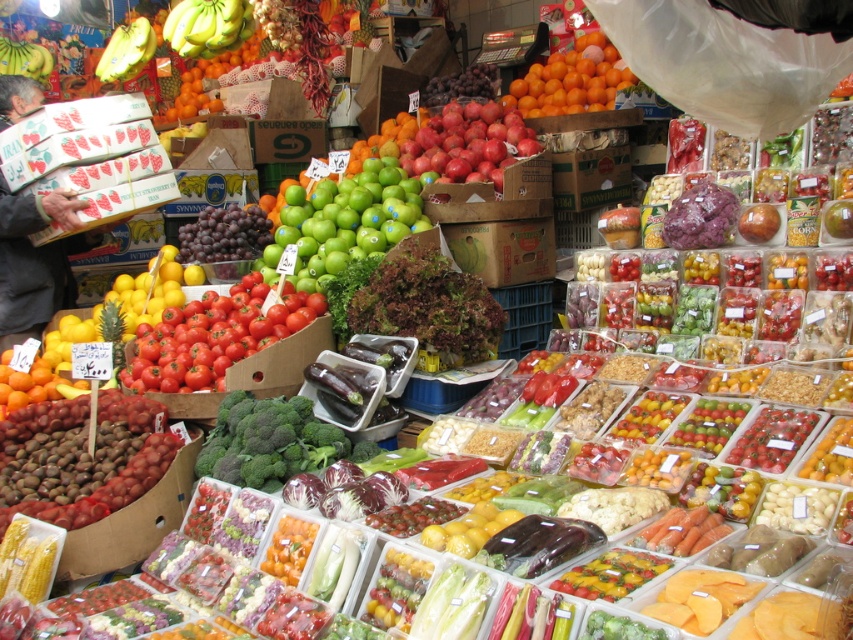
Can you confirm if green matte apples at center is taller than matte cardboard boxes at left?

Incorrect, green matte apples at center's height is not larger of matte cardboard boxes at left's.

Who is more distant from viewer, [373,218] or [12,102]?

Positioned behind is point [12,102].

Locate an element on the screen. green matte apples at center is located at coordinates (344, 221).

Is red matte tomatoes at center above shiny red apples at center?

No.

Which of these two, red matte tomatoes at center or shiny red apples at center, stands taller?

shiny red apples at center

Identify the location of red matte tomatoes at center. This screenshot has width=853, height=640. (225, 340).

Is red matte tomatoes at center thinner than matte cardboard boxes at left?

No, red matte tomatoes at center is not thinner than matte cardboard boxes at left.

Is red matte tomatoes at center shorter than matte cardboard boxes at left?

Yes.

Where is `red matte tomatoes at center`? Image resolution: width=853 pixels, height=640 pixels. red matte tomatoes at center is located at coordinates (225, 340).